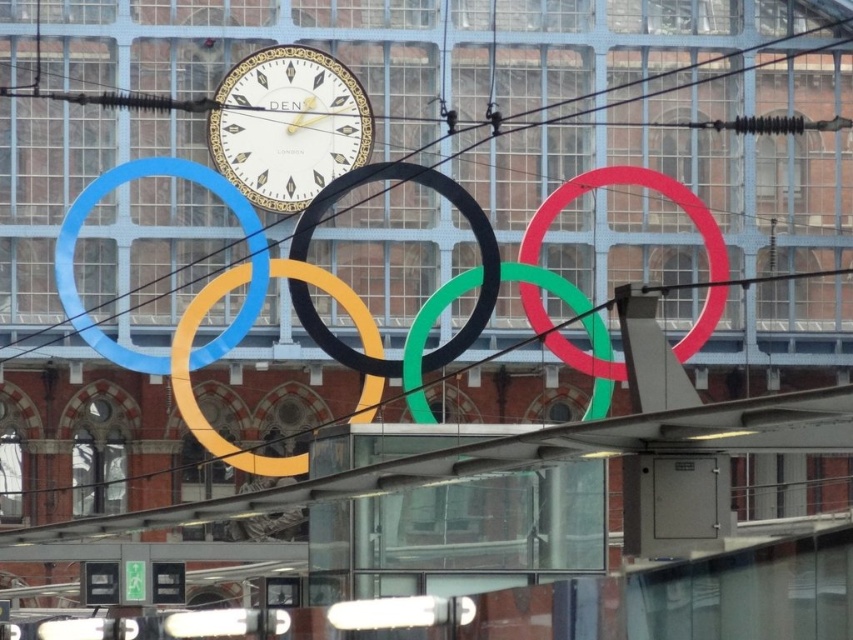
You are an interior designer planning to hang a new picture on the wall between the matte gold clock at center and the black rubber circle at center. Which object should you place the picture above to ensure it aligns with the existing arrangement?

The matte gold clock at center is located above the black rubber circle at center, so placing the picture above the matte gold clock at center would maintain the vertical alignment with the existing objects.

You are an interior designer planning to install a new decorative element between the matte gold clock at center and the black rubber circle at center. Since you want the new element to be wider than both existing objects, which one of the two existing objects should the new element be wider than?

The new element should be wider than the black rubber circle at center because the matte gold clock at center is narrower than the black rubber circle at center.

You are an athlete standing at the base of the building where the Olympic rings are displayed. You want to throw a ball to hit both the blue rubber ring at center and the green rubber ring at center. Can you reach both rings with a single throw if your maximum throwing distance is 15 meters?

The distance between the blue rubber ring at center and the green rubber ring at center is 17.55 meters, which exceeds your maximum throwing distance of 15 meters. Therefore, you cannot reach both rings with a single throw.